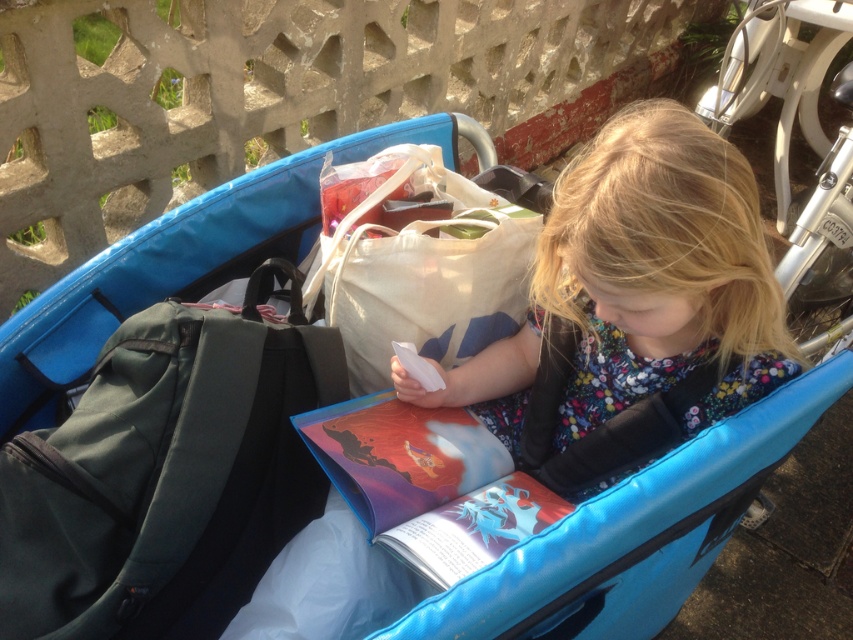
Question: Does dark green fabric backpack at left have a smaller size compared to canvas tote bag at center?

Choices:
 (A) no
 (B) yes

Answer: (A)

Question: Which of the following is the farthest from the observer?

Choices:
 (A) (68, 456)
 (B) (328, 253)

Answer: (B)

Question: Is floral fabric dress at center bigger than hardcover book at center?

Choices:
 (A) yes
 (B) no

Answer: (A)

Question: Is dark green fabric backpack at left further to the viewer compared to hardcover book at center?

Choices:
 (A) no
 (B) yes

Answer: (A)

Question: Considering the real-world distances, which object is farthest from the dark green fabric backpack at left?

Choices:
 (A) canvas tote bag at center
 (B) hardcover book at center
 (C) floral fabric dress at center

Answer: (C)

Question: Based on their relative distances, which object is nearer to the floral fabric dress at center?

Choices:
 (A) hardcover book at center
 (B) canvas tote bag at center
 (C) dark green fabric backpack at left

Answer: (B)